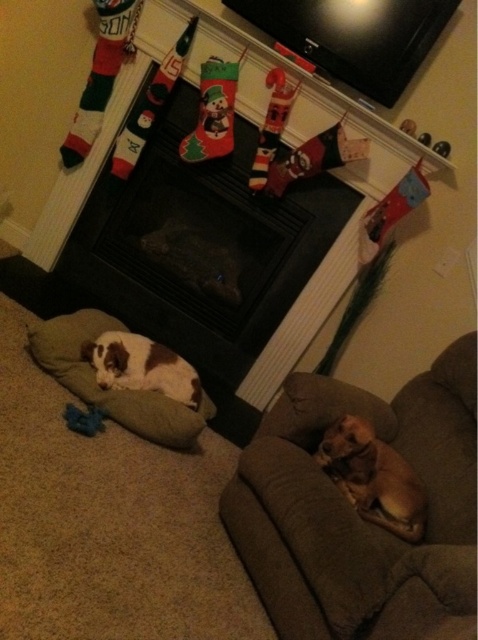
Question: Is black matte fireplace at center wider than brown and white plush dog at lower left?

Choices:
 (A) no
 (B) yes

Answer: (B)

Question: Considering the real-world distances, which object is farthest from the brown furry dog at lower right?

Choices:
 (A) black matte fireplace at center
 (B) brown fabric couch at lower right

Answer: (A)

Question: Among these objects, which one is farthest from the camera?

Choices:
 (A) brown and white plush dog at lower left
 (B) brown fabric couch at lower right
 (C) black matte fireplace at center

Answer: (C)

Question: Can you confirm if black matte fireplace at center is positioned above brown and white plush dog at lower left?

Choices:
 (A) yes
 (B) no

Answer: (A)

Question: Is green fabric dog bed at lower left bigger than brown furry dog at lower right?

Choices:
 (A) no
 (B) yes

Answer: (B)

Question: Which of these objects is positioned farthest from the brown fabric couch at lower right?

Choices:
 (A) green fabric dog bed at lower left
 (B) brown furry dog at lower right
 (C) brown and white plush dog at lower left
 (D) black matte fireplace at center

Answer: (D)